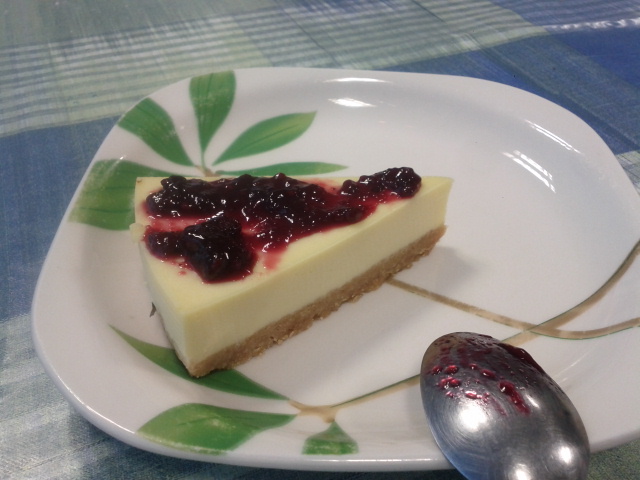
Where is `white stripes on tablecloth`? white stripes on tablecloth is located at coordinates (95, 79).